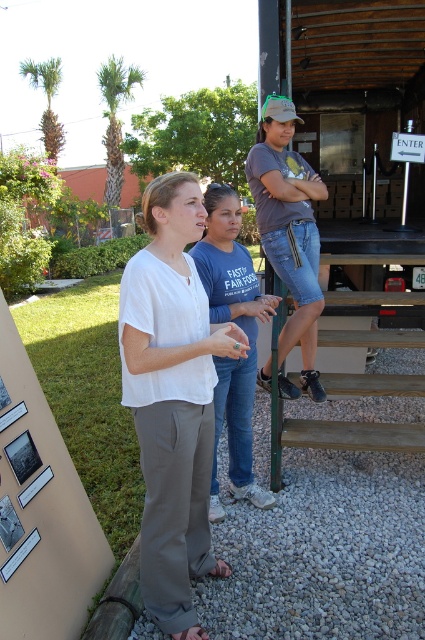
You are a photographer at the fair and want to capture a photo of the matte white blouse at center and the blue jeans at center. Which object should you focus on first if you want to ensure both are in focus without moving the camera?

Result: The blue jeans at center is located above the matte white blouse at center, so focusing on the blue jeans at center first will help ensure both are in focus since it is closer to the camera.

You are standing at the back of the scene and want to approach the blue jeans at center and the brown wooden stairs at center. Which object is taller when you look at them from your current position?

The blue jeans at center is taller than the brown wooden stairs at center.

You are a photographer trying to capture a clear shot of both the blue jeans at center and the brown wooden stairs at center. Which object should you focus on first to ensure both are in focus?

You should focus on the blue jeans at center first since it is closer to the viewer than the brown wooden stairs at center, allowing the stairs to fall into the depth of field once the closer object is in focus.